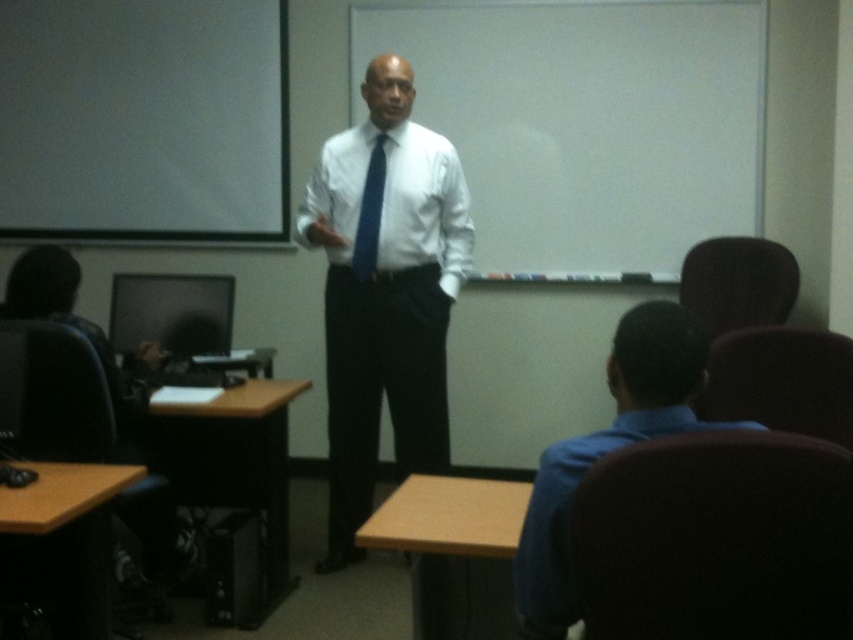
Question: Which of the following is the closest to the observer?

Choices:
 (A) blue silk tie at center
 (B) white smooth shirt at center
 (C) blue shirt at lower right

Answer: (C)

Question: Can you confirm if matte black monitor at left is positioned to the left of blue silk tie at center?

Choices:
 (A) no
 (B) yes

Answer: (B)

Question: Is white glossy shirt at center wider than white smooth shirt at center?

Choices:
 (A) yes
 (B) no

Answer: (B)

Question: Which point is farther from the camera taking this photo?

Choices:
 (A) [360, 204]
 (B) [142, 380]

Answer: (A)

Question: Can you confirm if blue shirt at lower right is bigger than white smooth shirt at center?

Choices:
 (A) yes
 (B) no

Answer: (B)

Question: Which of the following is the closest to the observer?

Choices:
 (A) white glossy shirt at center
 (B) blue silk tie at center
 (C) matte black monitor at left

Answer: (C)